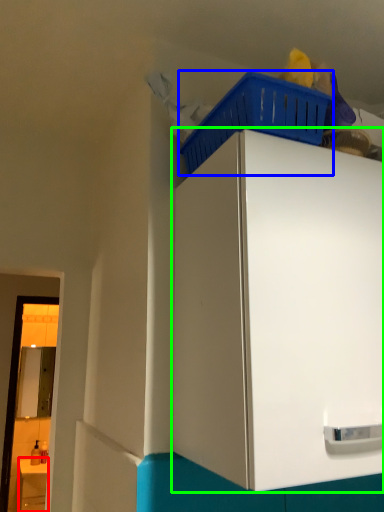
Question: Based on their relative distances, which object is nearer to counter (highlighted by a red box)? Choose from basket (highlighted by a blue box) and cabinetry (highlighted by a green box).

Choices:
 (A) basket
 (B) cabinetry

Answer: (B)